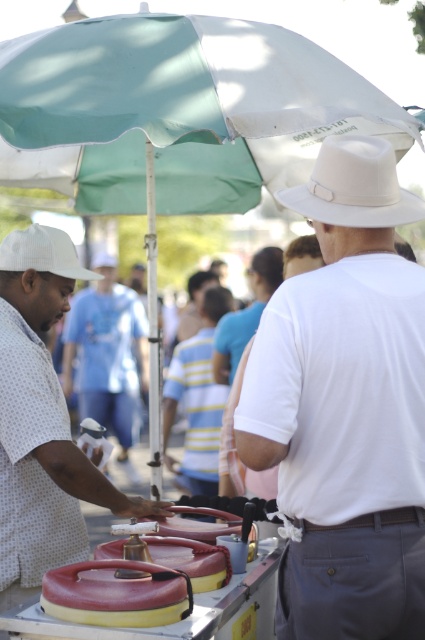
Question: Is white matte hat at upper center closer to the viewer compared to white dotted shirt at left?

Choices:
 (A) yes
 (B) no

Answer: (A)

Question: Which object is the farthest from the white matte hat at upper center?

Choices:
 (A) white dotted shirt at left
 (B) white fabric cowboy hat at left
 (C) white felt cowboy hat at upper center
 (D) white matte shirt at center

Answer: (D)

Question: Is white matte hat at upper center positioned in front of white felt cowboy hat at upper center?

Choices:
 (A) no
 (B) yes

Answer: (A)

Question: Among these points, which one is farthest from the camera?

Choices:
 (A) (36, 531)
 (B) (119, 288)

Answer: (B)

Question: Estimate the real-world distances between objects in this image. Which object is closer to the white matte hat at upper center?

Choices:
 (A) white felt cowboy hat at upper center
 (B) white dotted shirt at left

Answer: (A)

Question: In this image, where is white dotted shirt at left located relative to white fabric cowboy hat at left?

Choices:
 (A) below
 (B) above

Answer: (A)